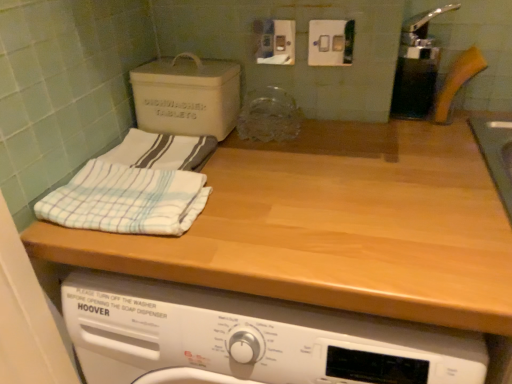
Question: Is wooden at upper center facing away from white striped cloth at upper left, which is the 1th bath towel in back-to-front order?

Choices:
 (A) yes
 (B) no

Answer: (B)

Question: Is wooden at upper center wider than white striped cloth at upper left, the second bath towel when ordered from front to back?

Choices:
 (A) no
 (B) yes

Answer: (B)

Question: Is wooden at upper center shorter than white striped cloth at upper left, the second bath towel when ordered from front to back?

Choices:
 (A) no
 (B) yes

Answer: (A)

Question: Can you confirm if wooden at upper center is bigger than white striped cloth at upper left, the second bath towel when ordered from front to back?

Choices:
 (A) yes
 (B) no

Answer: (A)

Question: Does wooden at upper center have a lesser width compared to white striped cloth at upper left, which is the 1th bath towel in back-to-front order?

Choices:
 (A) no
 (B) yes

Answer: (A)

Question: Is white striped cloth at upper left, which is the 1th bath towel in back-to-front order, to the left or to the right of white striped cloth at left, which is the first bath towel from front to back, in the image?

Choices:
 (A) right
 (B) left

Answer: (A)

Question: In the image, is white striped cloth at upper left, which is the 1th bath towel in back-to-front order, positioned in front of or behind white striped cloth at left, the second bath towel from the back?

Choices:
 (A) behind
 (B) front

Answer: (A)

Question: From a real-world perspective, relative to white striped cloth at left, the second bath towel from the back, is white striped cloth at upper left, the second bath towel when ordered from front to back, vertically above or below?

Choices:
 (A) above
 (B) below

Answer: (B)

Question: Considering the positions of white striped cloth at upper left, which is the 1th bath towel in back-to-front order, and white striped cloth at left, the second bath towel from the back, in the image, is white striped cloth at upper left, which is the 1th bath towel in back-to-front order, wider or thinner than white striped cloth at left, the second bath towel from the back,?

Choices:
 (A) thin
 (B) wide

Answer: (A)

Question: Is point (182, 57) positioned closer to the camera than point (196, 216)?

Choices:
 (A) farther
 (B) closer

Answer: (A)

Question: In the image, is matte gray cardboard box at upper left positioned in front of or behind white striped cloth at left, which is the first bath towel from front to back?

Choices:
 (A) behind
 (B) front

Answer: (A)

Question: From the image's perspective, is matte gray cardboard box at upper left above or below white striped cloth at left, which is the first bath towel from front to back?

Choices:
 (A) below
 (B) above

Answer: (B)

Question: Do you think matte gray cardboard box at upper left is within white striped cloth at left, which is the first bath towel from front to back, or outside of it?

Choices:
 (A) outside
 (B) inside

Answer: (A)

Question: From a real-world perspective, is white striped cloth at left, which is the first bath towel from front to back, physically located above or below matte gray cardboard box at upper left?

Choices:
 (A) below
 (B) above

Answer: (A)

Question: In terms of height, does white striped cloth at left, the second bath towel from the back, look taller or shorter compared to matte gray cardboard box at upper left?

Choices:
 (A) short
 (B) tall

Answer: (A)